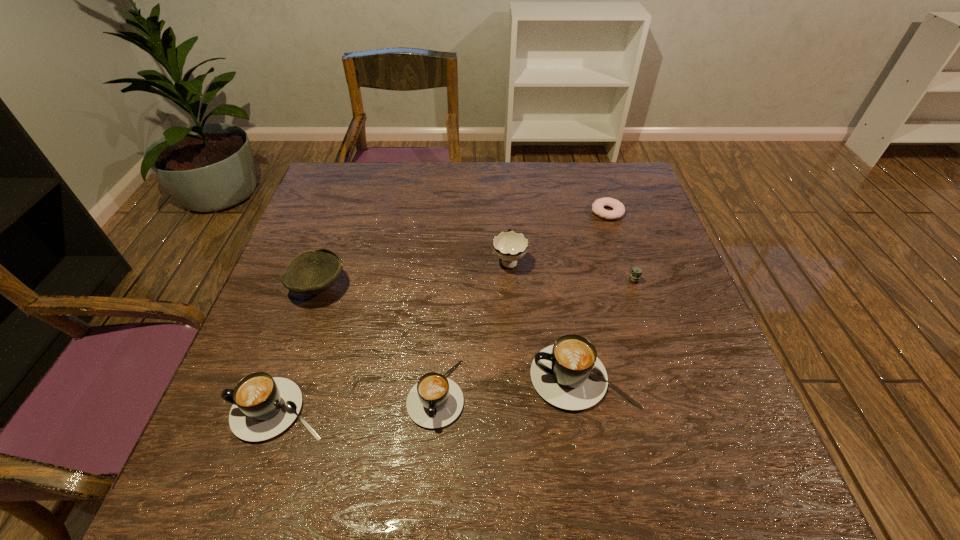
The height and width of the screenshot is (540, 960). I want to click on free point located 0.120m with the handle on the side of the rightmost cappuccino, so click(470, 377).

This screenshot has width=960, height=540. What are the coordinates of `vacant space located 0.320m with the handle on the side of the rightmost cappuccino` in the screenshot? It's located at (371, 377).

This screenshot has height=540, width=960. In order to click on vacant region located 0.200m on the left of the shortest object in this screenshot , I will do `click(521, 212)`.

Find the location of a particular element. The width and height of the screenshot is (960, 540). vacant region located 0.060m on the right of the bowl is located at coordinates (372, 287).

At what (x,y) coordinates should I click in order to perform the action: click on free region located 0.170m on the left of the second shortest object. Please return your answer as a coordinate pair (x, y). This screenshot has width=960, height=540. Looking at the image, I should click on (544, 281).

Locate an element on the screen. vacant area situated 0.310m on the side of the cup with the handle is located at coordinates (504, 179).

In order to click on free space located 0.140m on the side of the cup with the handle in this screenshot , I will do `click(506, 212)`.

At what (x,y) coordinates should I click in order to perform the action: click on vacant space located on the side of the cup with the handle. Please return your answer as a coordinate pair (x, y). Looking at the image, I should click on coord(505,192).

This screenshot has width=960, height=540. I want to click on object that is at the far edge, so click(618, 211).

What are the coordinates of `cappuccino at the left edge` in the screenshot? It's located at (263, 407).